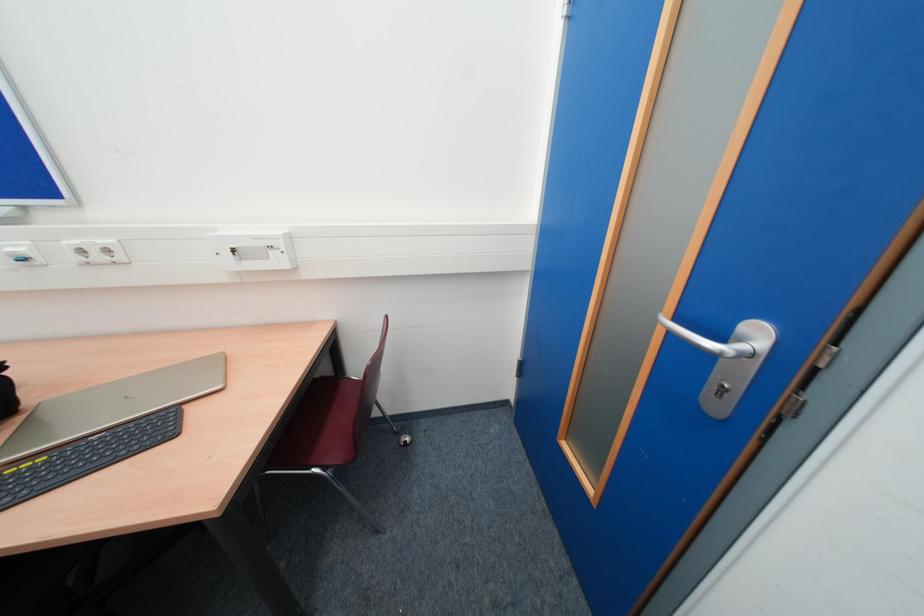
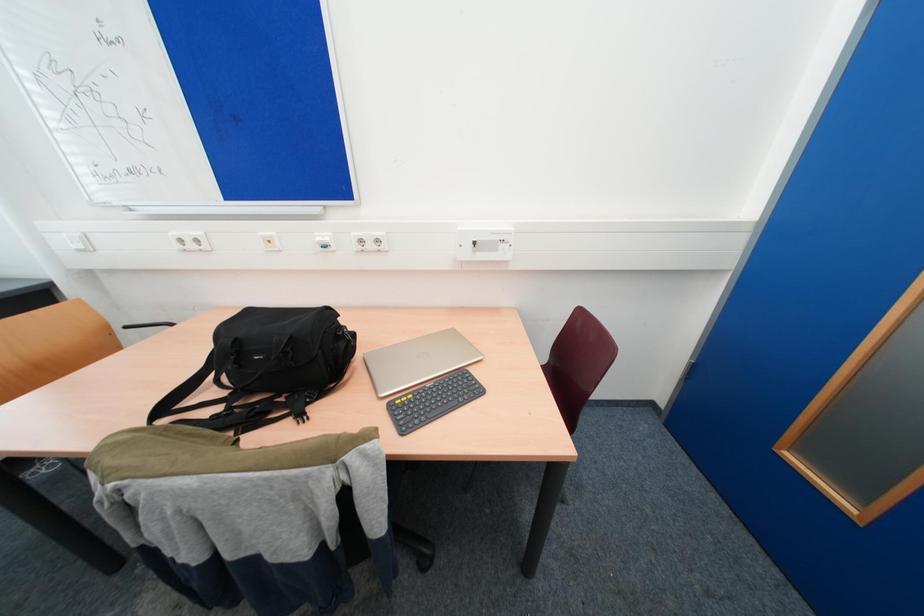
Question: In a continuous first-person perspective shot, in which direction is the camera moving?

Choices:
 (A) Left
 (B) Right
 (C) Forward
 (D) Backward

Answer: (A)